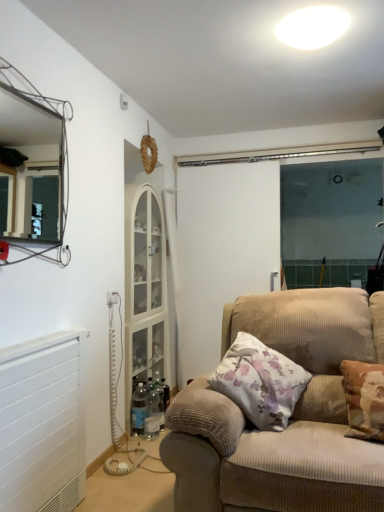
Question: Considering their positions, is white plastic electric outlet at lower left located in front of or behind white glossy ceiling light at upper center?

Choices:
 (A) behind
 (B) front

Answer: (A)

Question: In terms of size, does white plastic electric outlet at lower left appear bigger or smaller than white glossy ceiling light at upper center?

Choices:
 (A) small
 (B) big

Answer: (A)

Question: Which object is the closest to the white floral cushion at right?

Choices:
 (A) metallic wire frame mirror at upper left
 (B) white glossy ceiling light at upper center
 (C) white plastic electric outlet at lower left
 (D) white plastic radiator at lower left
 (E) beige corduroy couch at center

Answer: (E)

Question: Which object is positioned farthest from the white glossy ceiling light at upper center?

Choices:
 (A) white plastic electric outlet at lower left
 (B) metallic wire frame mirror at upper left
 (C) white plastic radiator at lower left
 (D) white floral cushion at right
 (E) beige corduroy couch at center

Answer: (B)